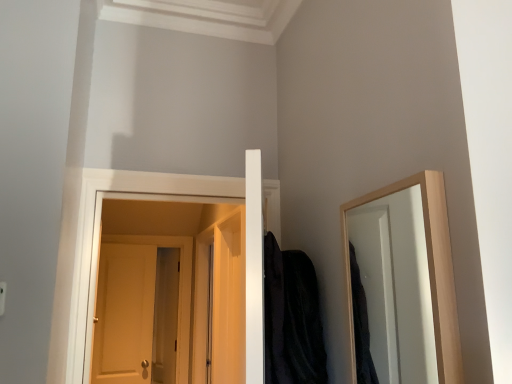
Question: From a real-world perspective, is matte wooden door at center over black velvet robe at center?

Choices:
 (A) yes
 (B) no

Answer: (B)

Question: Can you confirm if matte wooden door at center is taller than black velvet robe at center?

Choices:
 (A) no
 (B) yes

Answer: (B)

Question: Can you confirm if matte wooden door at center is positioned to the left of black velvet robe at center?

Choices:
 (A) no
 (B) yes

Answer: (B)

Question: Considering the relative positions of matte wooden door at center and black velvet robe at center in the image provided, is matte wooden door at center in front of black velvet robe at center?

Choices:
 (A) yes
 (B) no

Answer: (B)

Question: Considering the relative sizes of matte wooden door at center and black velvet robe at center in the image provided, is matte wooden door at center thinner than black velvet robe at center?

Choices:
 (A) no
 (B) yes

Answer: (B)

Question: From a real-world perspective, is matte wooden door at center physically below black velvet robe at center?

Choices:
 (A) no
 (B) yes

Answer: (B)

Question: Can we say black velvet robe at center lies outside matte wooden door at center?

Choices:
 (A) no
 (B) yes

Answer: (B)

Question: Is black velvet robe at center smaller than matte wooden door at center?

Choices:
 (A) yes
 (B) no

Answer: (A)

Question: From a real-world perspective, is black velvet robe at center on matte wooden door at center?

Choices:
 (A) yes
 (B) no

Answer: (A)

Question: From the image's perspective, is black velvet robe at center below matte wooden door at center?

Choices:
 (A) yes
 (B) no

Answer: (B)

Question: Is black velvet robe at center wider than matte wooden door at center?

Choices:
 (A) no
 (B) yes

Answer: (B)

Question: Is matte wooden door at center surrounded by black velvet robe at center?

Choices:
 (A) yes
 (B) no

Answer: (B)

Question: Considering the positions of point (266, 292) and point (187, 311), is point (266, 292) closer or farther from the camera than point (187, 311)?

Choices:
 (A) farther
 (B) closer

Answer: (B)